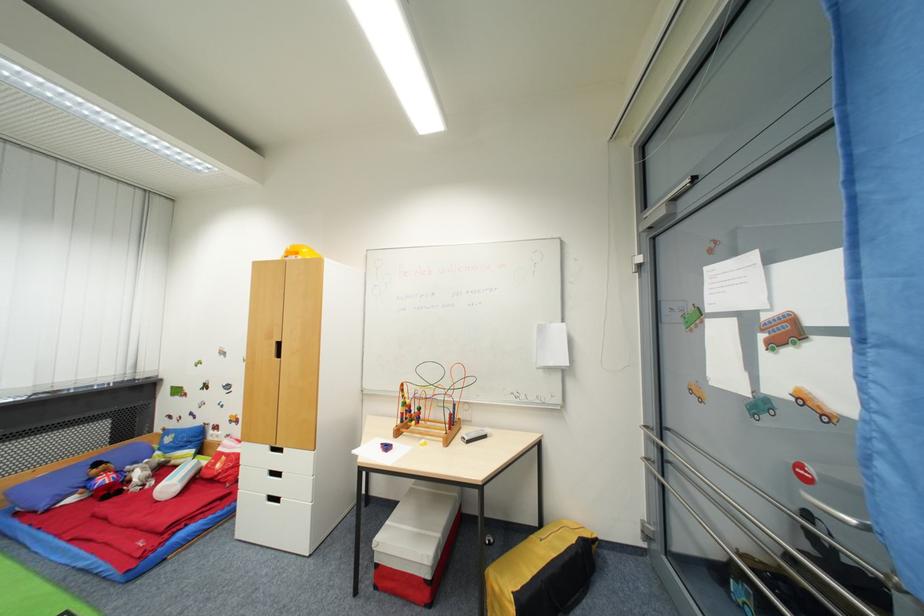
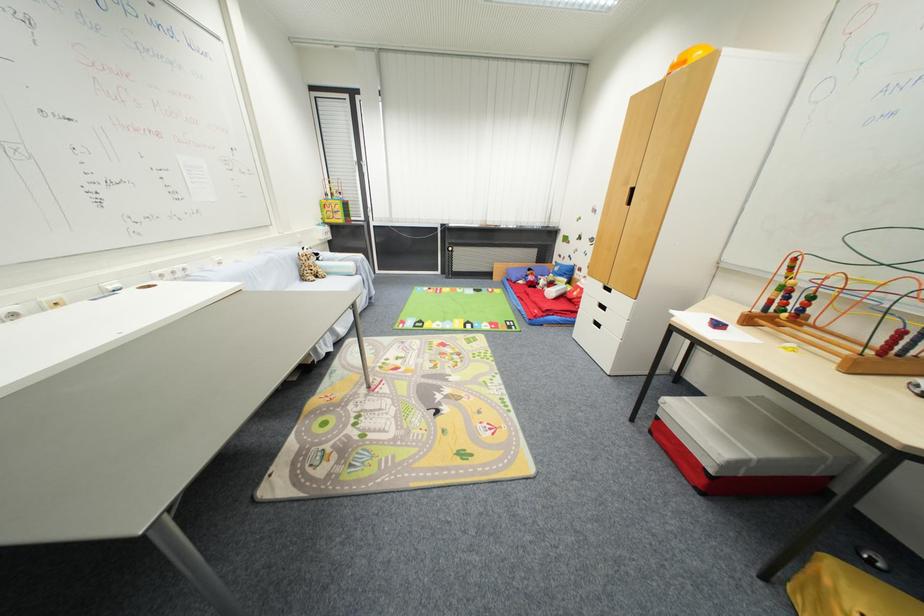
Question: I am providing you with two images of the same scene from different viewpoints. After the viewpoint changes to image2, which objects are now occluded?

Choices:
 (A) white drawer handle
 (B) bead maze toy
 (C) black cabinet handle
 (D) none of these

Answer: (D)